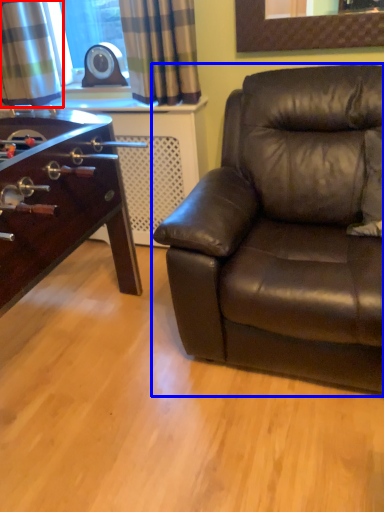
Question: Which object is closer to the camera taking this photo, curtain (highlighted by a red box) or studio couch (highlighted by a blue box)?

Choices:
 (A) curtain
 (B) studio couch

Answer: (B)